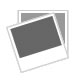
Locate an element on the screen. picture on top is located at coordinates (40, 58).